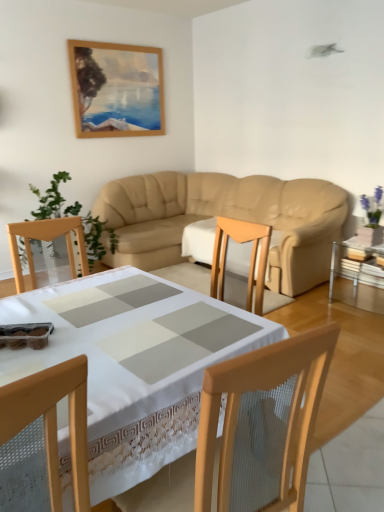
Question: Should I look upward or downward to see clear glass table at right, which ranks as the second table in front-to-back order?

Choices:
 (A) down
 (B) up

Answer: (A)

Question: Is clear glass table at right, which ranks as the second table in front-to-back order, facing away from beige leather couch at center?

Choices:
 (A) no
 (B) yes

Answer: (A)

Question: Is clear glass table at right, arranged as the 2th table when viewed from the left, to the left of beige leather couch at center from the viewer's perspective?

Choices:
 (A) yes
 (B) no

Answer: (B)

Question: Is beige leather couch at center inside clear glass table at right, which is the first table in back-to-front order?

Choices:
 (A) yes
 (B) no

Answer: (B)

Question: Does clear glass table at right, arranged as the 2th table when viewed from the left, touch beige leather couch at center?

Choices:
 (A) no
 (B) yes

Answer: (A)

Question: From the image's perspective, is clear glass table at right, placed as the first table when sorted from right to left, under beige leather couch at center?

Choices:
 (A) yes
 (B) no

Answer: (A)

Question: Can we say clear glass table at right, placed as the first table when sorted from right to left, lies outside beige leather couch at center?

Choices:
 (A) no
 (B) yes

Answer: (B)

Question: Is white lace tablecloth at center, which is the 2th table in back-to-front order, outside of green leafy plant at left?

Choices:
 (A) no
 (B) yes

Answer: (B)

Question: Is white lace tablecloth at center, the 2th table positioned from the right, bigger than green leafy plant at left?

Choices:
 (A) no
 (B) yes

Answer: (A)

Question: Is white lace tablecloth at center, the 1th table from the left, thinner than green leafy plant at left?

Choices:
 (A) no
 (B) yes

Answer: (A)

Question: Could you tell me if white lace tablecloth at center, which is the 2th table in back-to-front order, is facing green leafy plant at left?

Choices:
 (A) no
 (B) yes

Answer: (A)

Question: Is white lace tablecloth at center, arranged as the first table when viewed from the front, placed right next to green leafy plant at left?

Choices:
 (A) no
 (B) yes

Answer: (A)

Question: Can you confirm if white lace tablecloth at center, the 1th table from the left, is positioned to the left of green leafy plant at left?

Choices:
 (A) no
 (B) yes

Answer: (A)

Question: From a real-world perspective, is wooden chair at lower left physically below clear glass table at right, which ranks as the second table in front-to-back order?

Choices:
 (A) yes
 (B) no

Answer: (B)